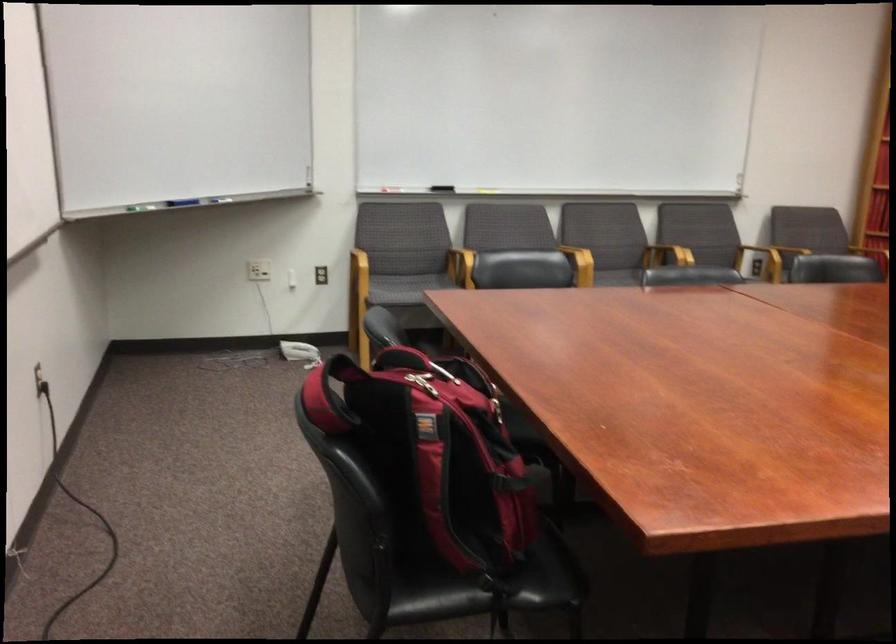
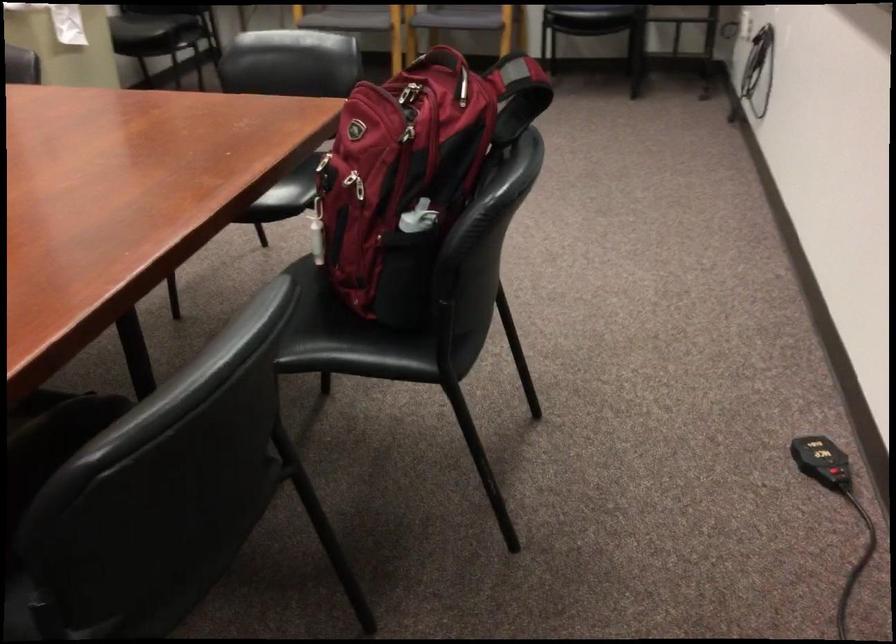
Locate, in the second image, the point that corresponds to point 496,375 in the first image.

(412, 136)